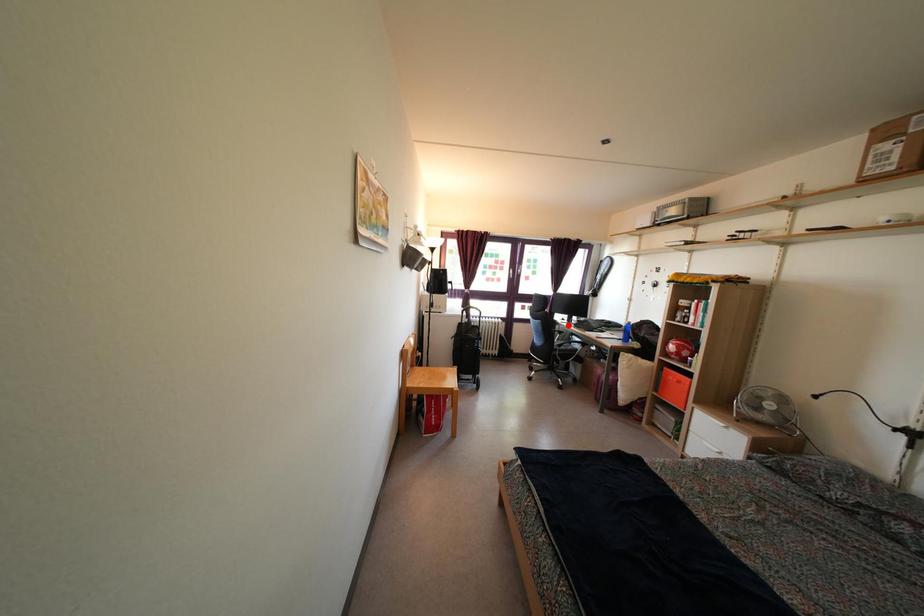
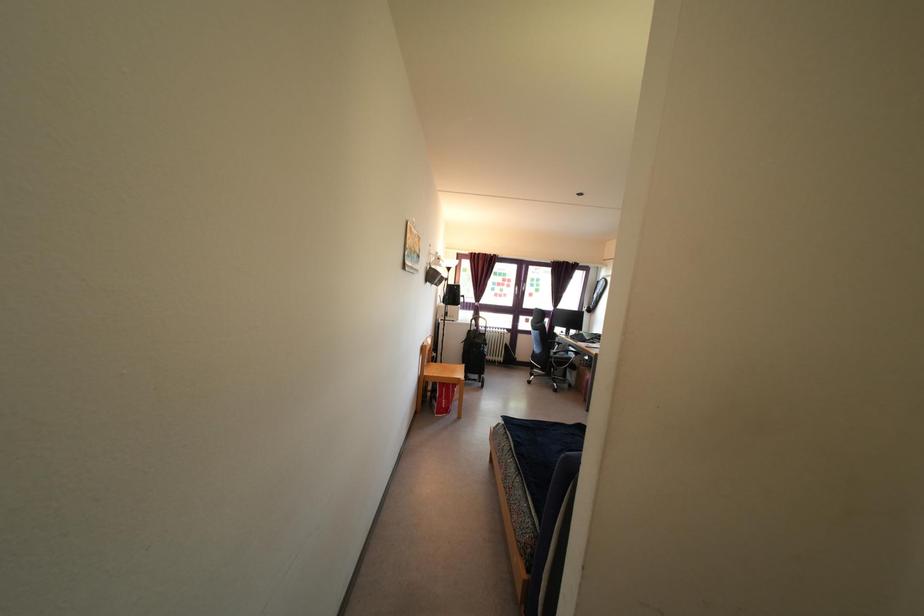
Where in the second image is the point corresponding to the highlighted location from the first image?

(566, 338)